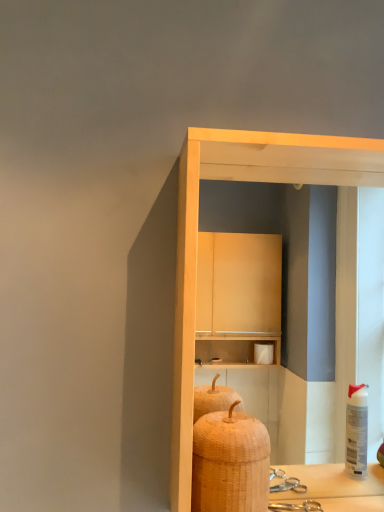
Where is `matte wood cabinet at center`? This screenshot has height=512, width=384. matte wood cabinet at center is located at coordinates (197, 239).

This screenshot has width=384, height=512. Describe the element at coordinates (197, 239) in the screenshot. I see `matte wood cabinet at center` at that location.

The height and width of the screenshot is (512, 384). I want to click on matte wood cabinet at center, so click(197, 239).